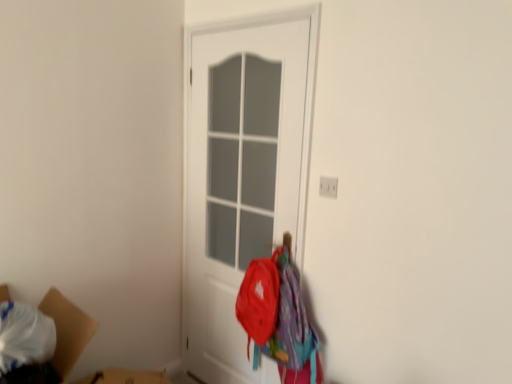
Where is `cardboard box at lower left`? This screenshot has width=512, height=384. cardboard box at lower left is located at coordinates (67, 330).

Describe the element at coordinates (328, 187) in the screenshot. The image size is (512, 384). I see `white plastic electric outlet at upper right` at that location.

Locate an element on the screen. cardboard box at lower left is located at coordinates (67, 330).

Considering the positions of objects cardboard box at lower left and white plastic electric outlet at upper right in the image provided, who is behind, cardboard box at lower left or white plastic electric outlet at upper right?

white plastic electric outlet at upper right is further from the camera.

Is cardboard box at lower left directly adjacent to white plastic electric outlet at upper right?

No, cardboard box at lower left is not next to white plastic electric outlet at upper right.

From the image's perspective, between cardboard box at lower left and white plastic electric outlet at upper right, which one is located above?

white plastic electric outlet at upper right appears higher in the image.

Looking at this image, is cardboard box at lower left not within white plastic electric outlet at upper right?

cardboard box at lower left is positioned outside white plastic electric outlet at upper right.

Considering the sizes of cardboard box at lower left and matte red backpack at lower right in the image, is cardboard box at lower left bigger or smaller than matte red backpack at lower right?

In the image, cardboard box at lower left appears to be larger than matte red backpack at lower right.

From the image's perspective, is cardboard box at lower left above or below matte red backpack at lower right?

Clearly, from the image's perspective, cardboard box at lower left is below matte red backpack at lower right.

Could you tell me if cardboard box at lower left is turned towards matte red backpack at lower right?

No, cardboard box at lower left does not turn towards matte red backpack at lower right.

Is matte red backpack at lower right located within cardboard box at lower left?

No, matte red backpack at lower right is not a part of cardboard box at lower left.

Is white plastic electric outlet at upper right positioned far away from white matte door at center?

white plastic electric outlet at upper right is far away from white matte door at center.

Is white plastic electric outlet at upper right wider than white matte door at center?

Incorrect, the width of white plastic electric outlet at upper right does not surpass that of white matte door at center.

Is point (320, 182) positioned after point (305, 128)?

No, (320, 182) is in front of (305, 128).

Could you tell me if white matte door at center is turned towards cardboard box at lower left?

Yes.

From the image's perspective, is white matte door at center above cardboard box at lower left?

Correct, white matte door at center appears higher than cardboard box at lower left in the image.

From their relative heights in the image, would you say white matte door at center is taller or shorter than cardboard box at lower left?

Clearly, white matte door at center is taller compared to cardboard box at lower left.

Is the depth of white matte door at center less than that of cardboard box at lower left?

No, the depth of white matte door at center is greater than that of cardboard box at lower left.

From the image's perspective, which object appears higher, white plastic electric outlet at upper right or matte red backpack at lower right?

white plastic electric outlet at upper right.

Does point (322, 194) appear closer or farther from the camera than point (277, 283)?

Point (322, 194).

Is white plastic electric outlet at upper right positioned with its back to matte red backpack at lower right?

No, matte red backpack at lower right is not at the back of white plastic electric outlet at upper right.

You are a GUI agent. You are given a task and a screenshot of the screen. Output one action in this format:
    pyautogui.click(x=<x>, y=<y>)
    Task: Click on the electric outlet that is above the matte red backpack at lower right (from a real-world perspective)
    Image resolution: width=512 pixels, height=384 pixels.
    Given the screenshot: What is the action you would take?
    (x=328, y=187)

From a real-world perspective, is matte red backpack at lower right physically above cardboard box at lower left?

Yes, from a real-world perspective, matte red backpack at lower right is above cardboard box at lower left.

Is matte red backpack at lower right in front of cardboard box at lower left?

No, the depth of matte red backpack at lower right is greater than that of cardboard box at lower left.

Who is shorter, matte red backpack at lower right or cardboard box at lower left?

Standing shorter between the two is cardboard box at lower left.

Are matte red backpack at lower right and cardboard box at lower left located far from each other?

No, matte red backpack at lower right is not far away from cardboard box at lower left.

Can we say white matte door at center lies outside white plastic electric outlet at upper right?

Absolutely, white matte door at center is external to white plastic electric outlet at upper right.

How distant is white matte door at center from white plastic electric outlet at upper right?

3.47 feet.

From the picture: Is white matte door at center aimed at white plastic electric outlet at upper right?

No.

From a real-world perspective, is white matte door at center above or below white plastic electric outlet at upper right?

From a real-world perspective, white matte door at center is physically below white plastic electric outlet at upper right.

This screenshot has height=384, width=512. In order to click on electric outlet above the cardboard box at lower left (from the image's perspective) in this screenshot , I will do `click(328, 187)`.

I want to click on laundry lying on the right of cardboard box at lower left, so click(278, 317).

When comparing their distances from cardboard box at lower left, does white plastic electric outlet at upper right or white matte door at center seem closer?

The object closer to cardboard box at lower left is white plastic electric outlet at upper right.

When comparing their distances from white plastic electric outlet at upper right, does cardboard box at lower left or matte red backpack at lower right seem closer?

The object closer to white plastic electric outlet at upper right is matte red backpack at lower right.

Which object lies nearer to the anchor point white plastic electric outlet at upper right, white matte door at center or matte red backpack at lower right?

matte red backpack at lower right lies closer to white plastic electric outlet at upper right than the other object.

Which object lies nearer to the anchor point white matte door at center, matte red backpack at lower right or white plastic electric outlet at upper right?

Among the two, matte red backpack at lower right is located nearer to white matte door at center.

Looking at the image, which one is located further to cardboard box at lower left, matte red backpack at lower right or white matte door at center?

Among the two, white matte door at center is located further to cardboard box at lower left.

From the image, which object appears to be farther from white matte door at center, cardboard box at lower left or white plastic electric outlet at upper right?

cardboard box at lower left is positioned further to the anchor white matte door at center.

From the image, which object appears to be farther from matte red backpack at lower right, white matte door at center or white plastic electric outlet at upper right?

Among the two, white plastic electric outlet at upper right is located further to matte red backpack at lower right.

Which object lies further to the anchor point cardboard box at lower left, white matte door at center or matte red backpack at lower right?

white matte door at center lies further to cardboard box at lower left than the other object.

Locate an element on the screen. This screenshot has height=384, width=512. door that lies between white plastic electric outlet at upper right and matte red backpack at lower right from top to bottom is located at coordinates (240, 175).

Locate an element on the screen. laundry between cardboard box at lower left and white plastic electric outlet at upper right from left to right is located at coordinates (278, 317).

At what (x,y) coordinates should I click in order to perform the action: click on door between cardboard box at lower left and matte red backpack at lower right. Please return your answer as a coordinate pair (x, y). Image resolution: width=512 pixels, height=384 pixels. Looking at the image, I should click on (240, 175).

Image resolution: width=512 pixels, height=384 pixels. Identify the location of door between cardboard box at lower left and white plastic electric outlet at upper right from left to right. (240, 175).